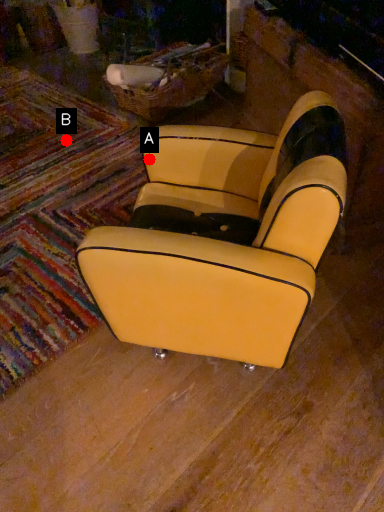
Question: Two points are circled on the image, labeled by A and B beside each circle. Which point is closer to the camera taking this photo?

Choices:
 (A) A is closer
 (B) B is closer

Answer: (A)